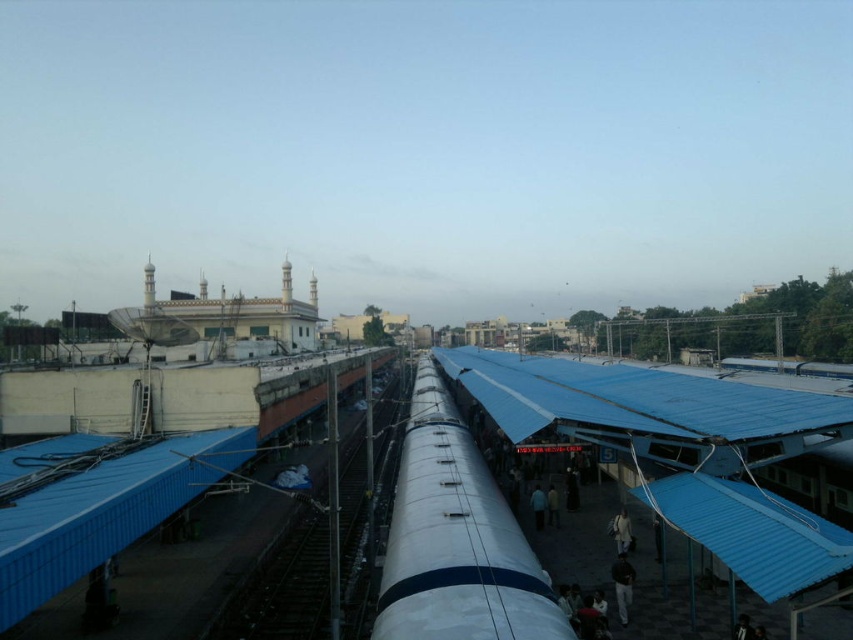
This screenshot has width=853, height=640. Find the location of `light brown fabric jacket at lower right`. light brown fabric jacket at lower right is located at coordinates (621, 531).

Does light brown fabric jacket at lower right lie behind dark blue fabric at center?

No, light brown fabric jacket at lower right is in front of dark blue fabric at center.

Locate an element on the screen. The image size is (853, 640). light brown fabric jacket at lower right is located at coordinates (621, 531).

The height and width of the screenshot is (640, 853). I want to click on light brown fabric jacket at lower right, so tap(621, 531).

Between smooth metal train track at center and dark gray fabric pants at lower right, which one has more height?

Standing taller between the two is smooth metal train track at center.

Is smooth metal train track at center to the left of dark gray fabric pants at lower right from the viewer's perspective?

Yes, smooth metal train track at center is to the left of dark gray fabric pants at lower right.

Based on the photo, who is more distant from viewer, (252,593) or (619,557)?

Positioned behind is point (252,593).

Locate an element on the screen. The image size is (853, 640). smooth metal train track at center is located at coordinates (318, 540).

Is smooth metal train track at center smaller than light brown fabric jacket at lower right?

No.

How distant is smooth metal train track at center from light brown fabric jacket at lower right?

smooth metal train track at center and light brown fabric jacket at lower right are 20.54 meters apart from each other.

What do you see at coordinates (318, 540) in the screenshot? The image size is (853, 640). I see `smooth metal train track at center` at bounding box center [318, 540].

The image size is (853, 640). Find the location of `smooth metal train track at center`. smooth metal train track at center is located at coordinates (318, 540).